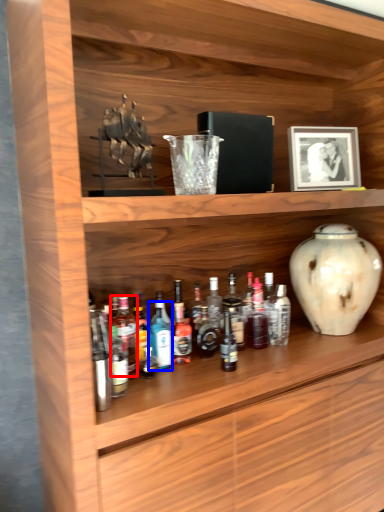
Question: Which object is further to the camera taking this photo, bottle (highlighted by a red box) or bottle (highlighted by a blue box)?

Choices:
 (A) bottle
 (B) bottle

Answer: (B)